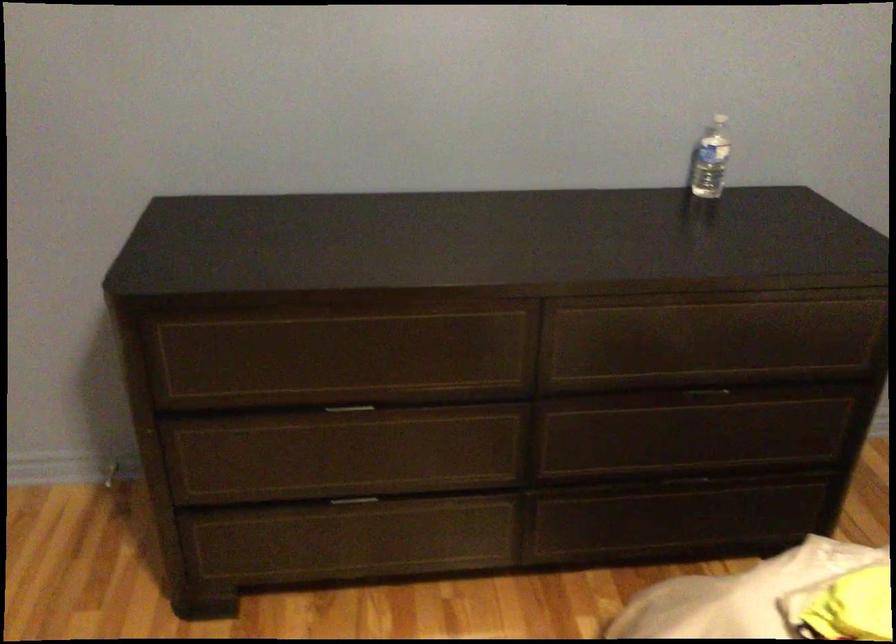
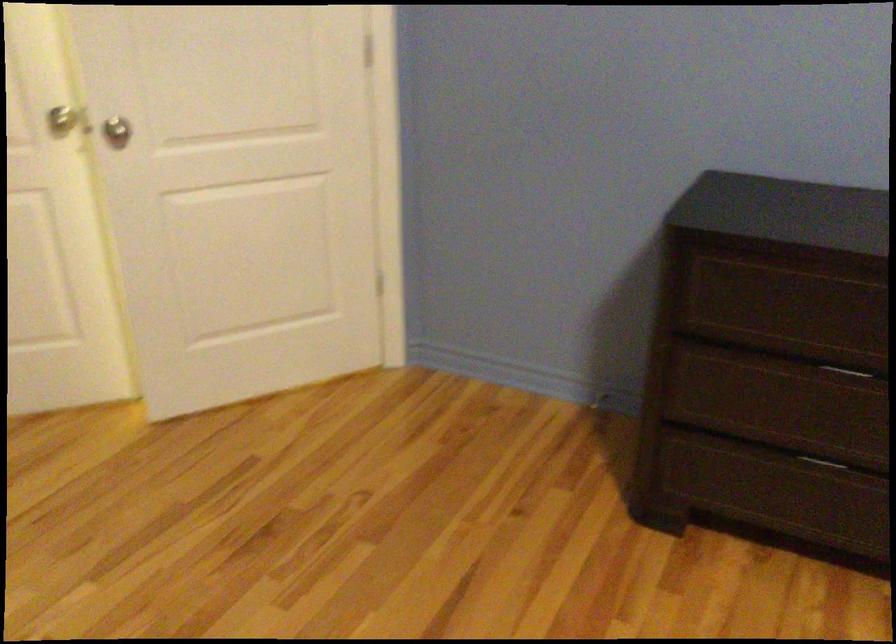
Locate, in the second image, the point that corresponds to (x=345, y=410) in the first image.

(850, 371)